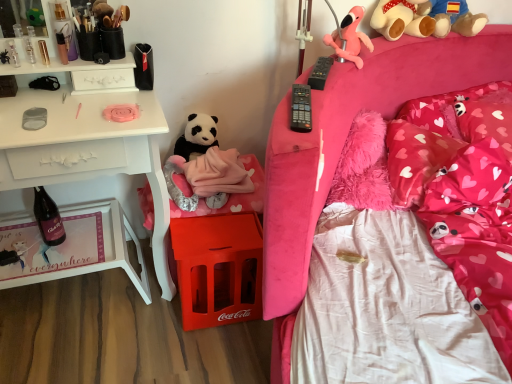
This screenshot has height=384, width=512. I want to click on vacant area to the right of matte glass bottle at lower left, so click(90, 258).